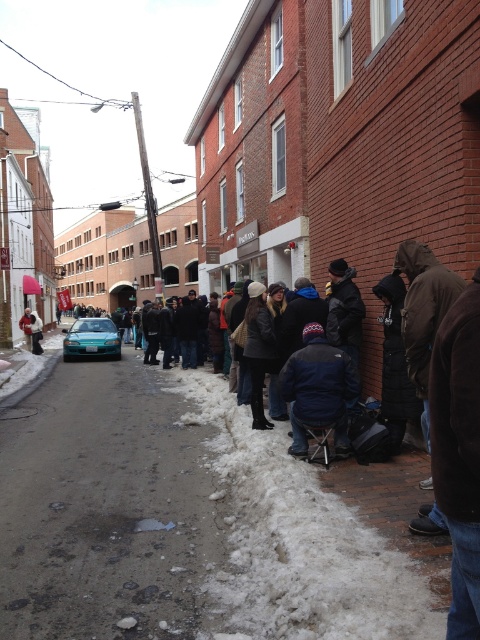
You are a delivery person trying to avoid stepping on the porous asphalt road at lower center. You see the dark blue fleece jacket at center. Which direction should you move to stay away from the road?

The porous asphalt road at lower center is located below the dark blue fleece jacket at center, so moving away from the jacket towards the upper area would keep you off the road.

You are standing at the point marked by the coordinate point (105,508) on the road. Looking around, you see the porous asphalt road at lower center. What is the material of the road surface at your current location?

The porous asphalt road at lower center is the material at your current location.